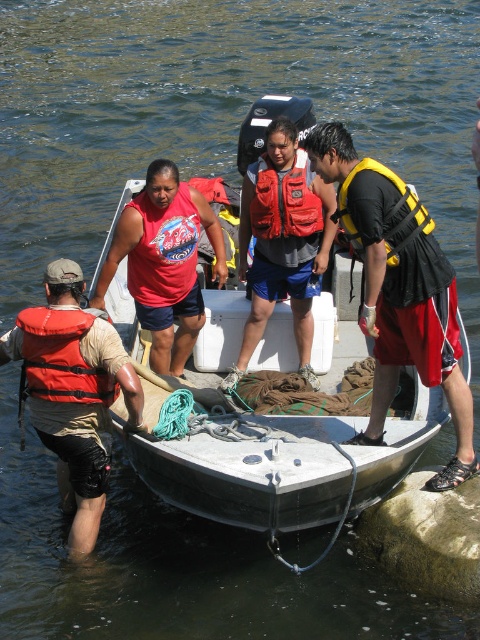
Is red life vest at center further to camera compared to matte orange life jacket at left?

Yes, it is.

Find the location of a particular element. Image resolution: width=480 pixels, height=640 pixels. red life vest at center is located at coordinates (283, 243).

Is point (253, 291) farther from viewer compared to point (33, 353)?

Yes, point (253, 291) is behind point (33, 353).

Identify the location of red life vest at center. pos(283,243).

This screenshot has width=480, height=640. In order to click on metallic gray boat at center in this screenshot , I will do `click(285, 465)`.

Between metallic gray boat at center and orange life jacket at center, which one has less height?

orange life jacket at center is shorter.

Which is in front, point (222, 504) or point (310, 195)?

Point (222, 504)

The width and height of the screenshot is (480, 640). I want to click on metallic gray boat at center, so click(x=285, y=465).

Is point (315, 502) behind point (444, 332)?

No, it is not.

Is metallic gray boat at center in front of yellow/black life vest at center?

Yes, it is.

Find the location of a particular element. Image resolution: width=480 pixels, height=640 pixels. metallic gray boat at center is located at coordinates (285, 465).

Find the location of a particular element. metallic gray boat at center is located at coordinates (285, 465).